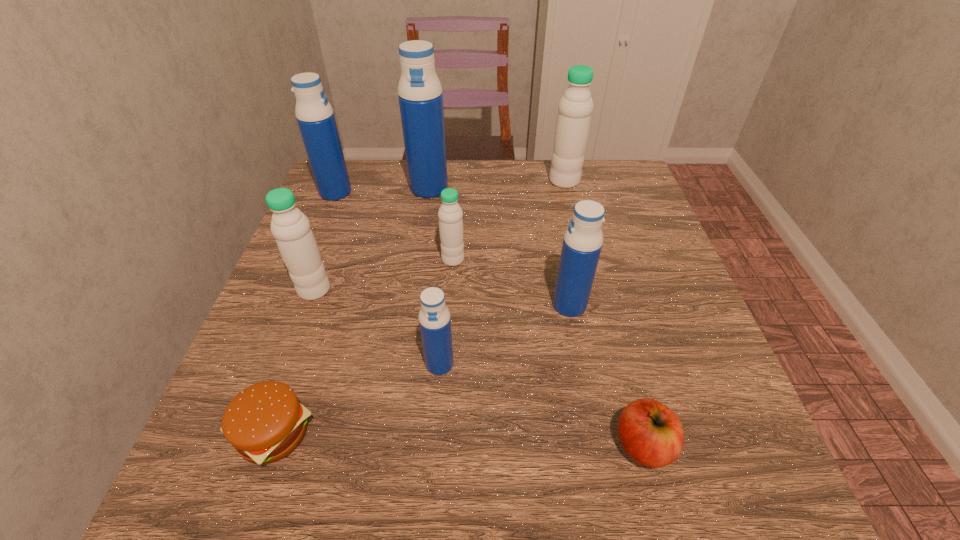
Locate an element on the screen. Image resolution: width=960 pixels, height=540 pixels. the tallest water bottle is located at coordinates (420, 95).

Find the location of a particular element. The height and width of the screenshot is (540, 960). the tallest object is located at coordinates (420, 95).

The height and width of the screenshot is (540, 960). I want to click on the biggest white water bottle, so click(575, 107).

The image size is (960, 540). Identify the location of the rightmost white water bottle. (575, 107).

Where is `the second biggest blue water bottle`? This screenshot has height=540, width=960. the second biggest blue water bottle is located at coordinates (314, 114).

Identify the location of the second smallest blue water bottle. This screenshot has width=960, height=540. (583, 239).

At what (x,y) coordinates should I click in order to perform the action: click on the rightmost blue water bottle. Please return your answer as a coordinate pair (x, y). This screenshot has width=960, height=540. Looking at the image, I should click on [x=583, y=239].

I want to click on the leftmost white water bottle, so click(291, 228).

Image resolution: width=960 pixels, height=540 pixels. Identify the location of the nearest white water bottle. (291, 228).

What are the coordinates of `the fourth farthest object` in the screenshot? It's located at (450, 214).